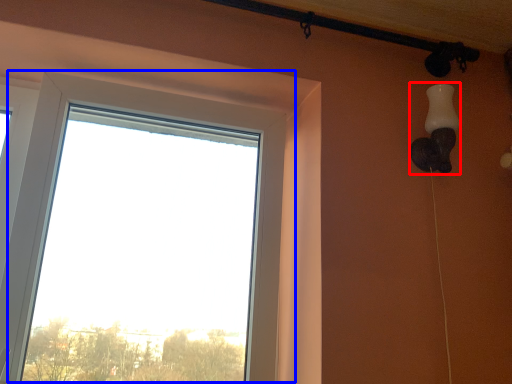
Question: Which object is further to the camera taking this photo, lamp (highlighted by a red box) or window (highlighted by a blue box)?

Choices:
 (A) lamp
 (B) window

Answer: (A)